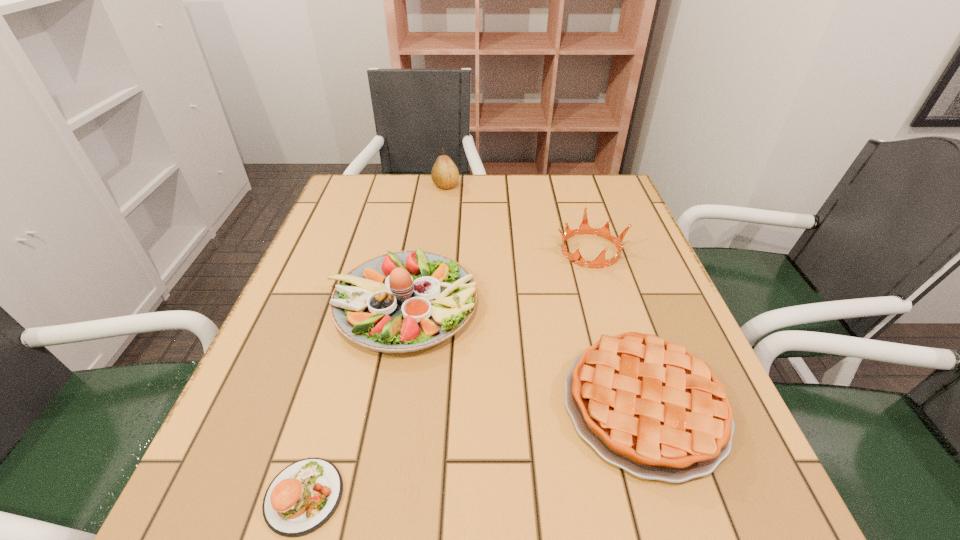
The width and height of the screenshot is (960, 540). I want to click on the farthest object, so click(x=444, y=174).

Locate an element on the screen. salad plate is located at coordinates (405, 301).

Where is `crown`? crown is located at coordinates (600, 262).

This screenshot has height=540, width=960. I want to click on the second shortest object, so click(646, 405).

Identify the location of the shortest object. (303, 496).

In order to click on free spot located 0.200m on the right of the pear in this screenshot , I will do `click(525, 186)`.

This screenshot has height=540, width=960. I want to click on vacant space located on the right of the salad plate, so click(649, 304).

You are a GUI agent. You are given a task and a screenshot of the screen. Output one action in this format:
    pyautogui.click(x=<x>, y=<y>)
    Task: Click on the free region located 0.060m on the front of the third tallest object
    Image resolution: width=960 pixels, height=540 pixels.
    Given the screenshot: What is the action you would take?
    pyautogui.click(x=603, y=291)

Image resolution: width=960 pixels, height=540 pixels. Find the location of `vacant space located 0.100m on the back of the fourth tallest object`. vacant space located 0.100m on the back of the fourth tallest object is located at coordinates (613, 307).

Find the location of `vacant space situated on the right of the shortest object`. vacant space situated on the right of the shortest object is located at coordinates (553, 496).